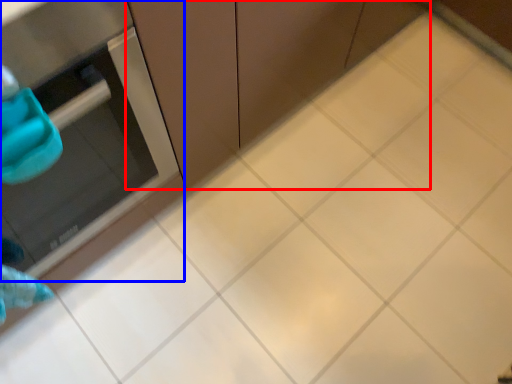
Question: Which object appears closest to the camera in this image, cabinetry (highlighted by a red box) or appliance (highlighted by a blue box)?

Choices:
 (A) cabinetry
 (B) appliance

Answer: (B)